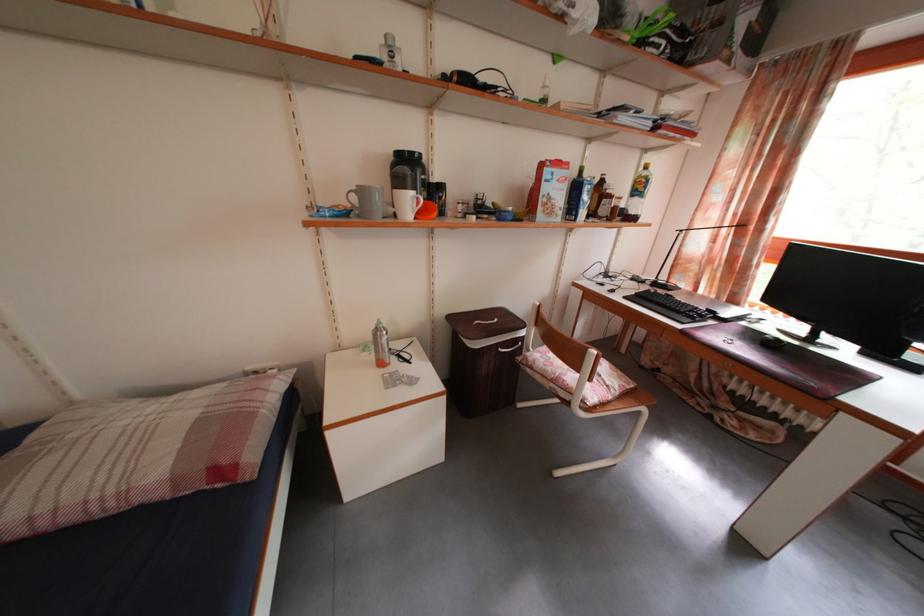
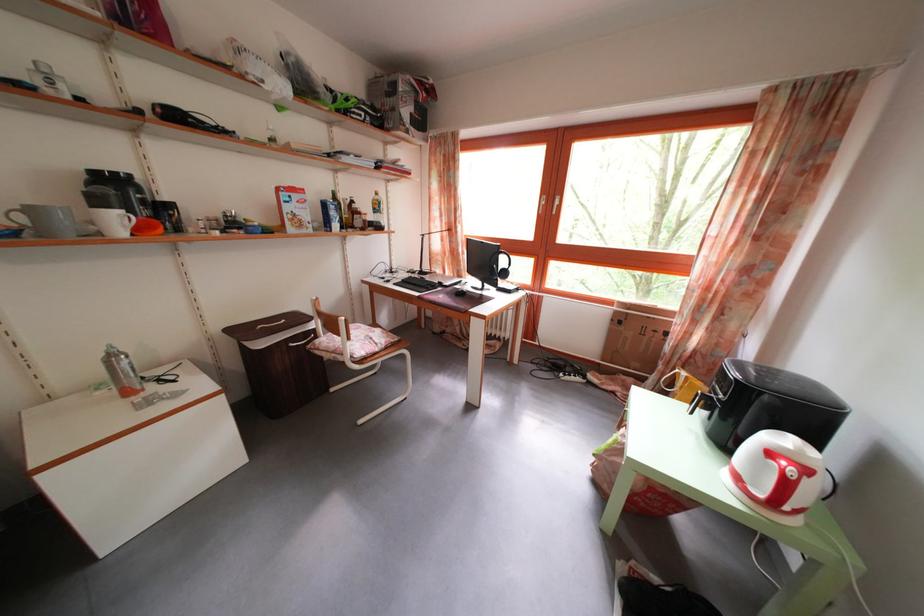
In the second image, find the point that corresponds to (x=529, y=346) in the first image.

(322, 339)